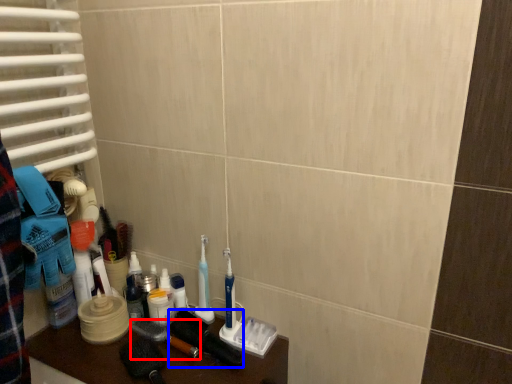
Question: Among these objects, which one is nearest to the camera, brush (highlighted by a red box) or brush (highlighted by a blue box)?

Choices:
 (A) brush
 (B) brush

Answer: (B)